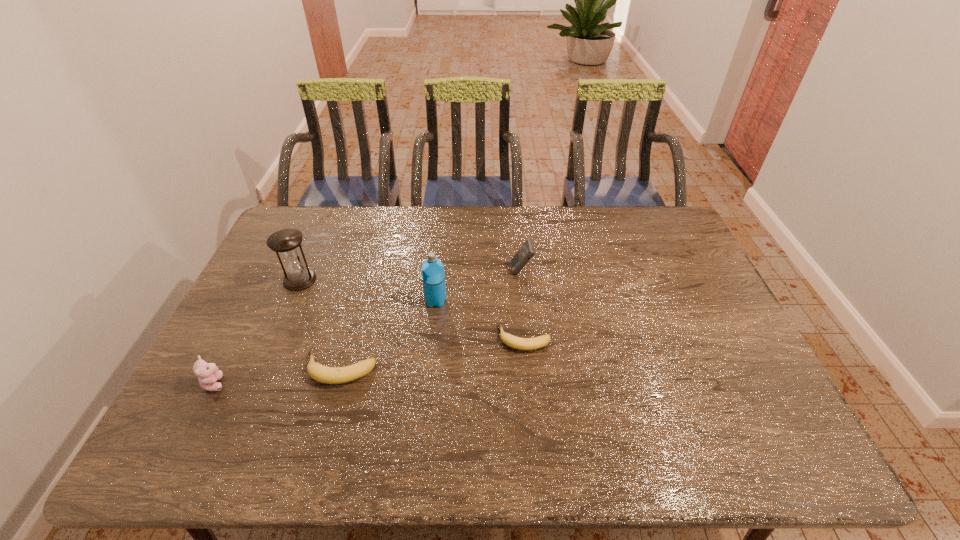
Please point a free position for a banana on the right. Please provide its 2D coordinates. Your answer should be formatted as a tuple, i.e. [(x, y)], where the tuple contains the x and y coordinates of a point satisfying the conditions above.

[(687, 312)]